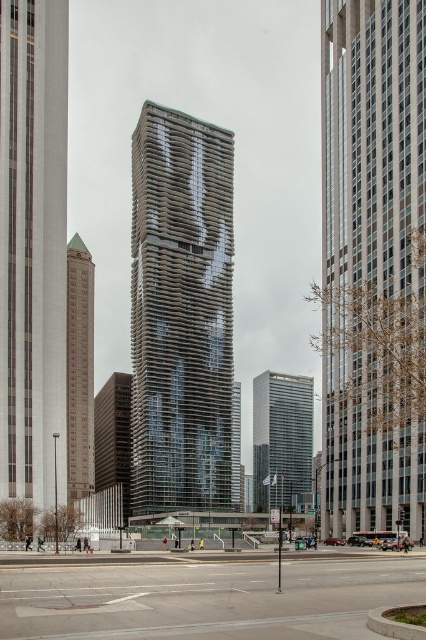
Question: Based on their relative distances, which object is farther from the glassy reflective skyscraper at center?

Choices:
 (A) dark gray concrete building at center
 (B) brown brick building at left
 (C) glassy metallic tower at center
 (D) glassy steel skyscraper at center

Answer: (D)

Question: Which point is closer to the camera?

Choices:
 (A) glassy reflective skyscraper at center
 (B) smooth white skyscraper at left
 (C) brown brick building at left

Answer: (A)

Question: Is glassy steel skyscraper at center further to the viewer compared to brown brick building at left?

Choices:
 (A) yes
 (B) no

Answer: (A)

Question: Which is farther from the smooth white skyscraper at left?

Choices:
 (A) glassy reflective skyscraper at center
 (B) glassy metallic tower at center
 (C) brown brick building at left
 (D) dark gray concrete building at center

Answer: (D)

Question: Is glassy steel skyscraper at center to the right of brown brick building at left from the viewer's perspective?

Choices:
 (A) yes
 (B) no

Answer: (A)

Question: Is glassy steel skyscraper at center below brown brick building at left?

Choices:
 (A) no
 (B) yes

Answer: (B)